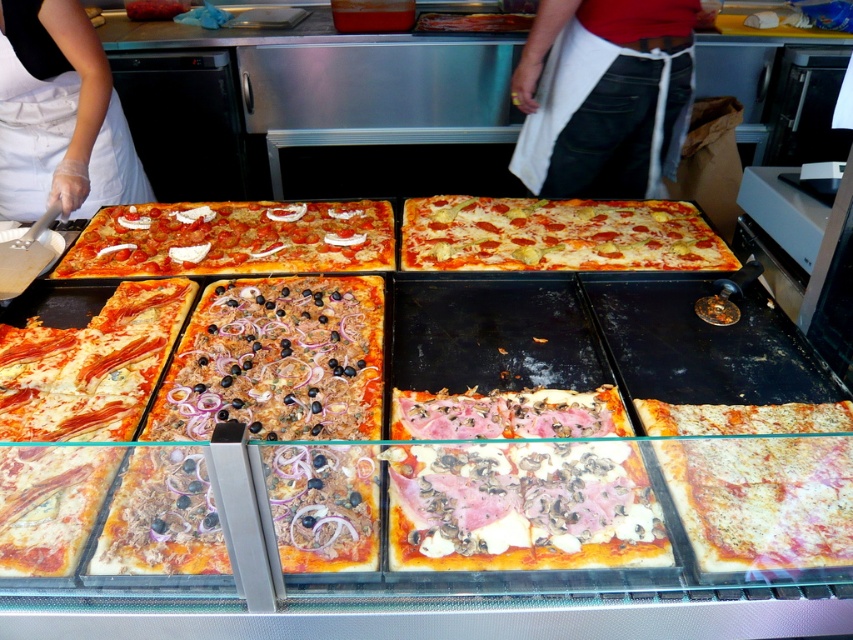
Question: Which of the following is the farthest from the observer?

Choices:
 (A) (65, 70)
 (B) (299, 202)
 (C) (549, 49)
 (D) (515, 464)

Answer: (C)

Question: Does white apron at center have a smaller size compared to cheesy pizza at center?

Choices:
 (A) no
 (B) yes

Answer: (A)

Question: Observing the image, what is the correct spatial positioning of white creamy topping at center in reference to cheesy pizza at center?

Choices:
 (A) left
 (B) right

Answer: (A)

Question: Among these objects, which one is farthest from the camera?

Choices:
 (A) cheesy white pizza at center
 (B) white creamy cheese at center

Answer: (B)

Question: Among these objects, which one is nearest to the camera?

Choices:
 (A) cheesy white pizza at center
 (B) shiny red pizza with onions and olives at center

Answer: (A)

Question: Is cheesy white pizza at center to the left of cheesy pizza at center from the viewer's perspective?

Choices:
 (A) no
 (B) yes

Answer: (A)